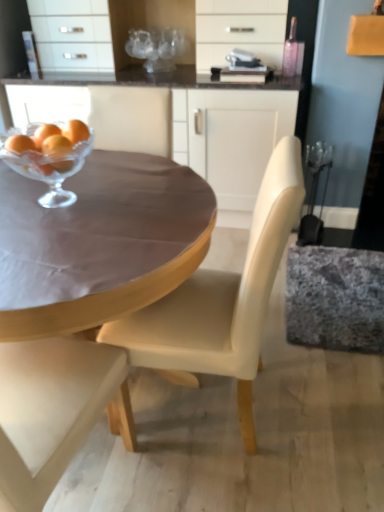
What are the coordinates of `vacant area located to the right-hand side of clear glass bowl at center` in the screenshot? It's located at (147, 194).